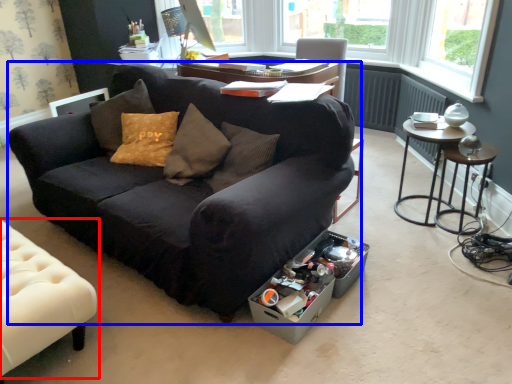
Question: Among these objects, which one is nearest to the camera, chair (highlighted by a red box) or studio couch (highlighted by a blue box)?

Choices:
 (A) chair
 (B) studio couch

Answer: (B)